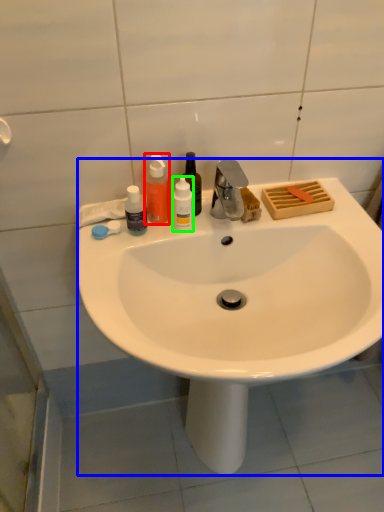
Question: Which is nearer to the bottle (highlighted by a red box)? sink (highlighted by a blue box) or bottle (highlighted by a green box).

Choices:
 (A) sink
 (B) bottle

Answer: (B)